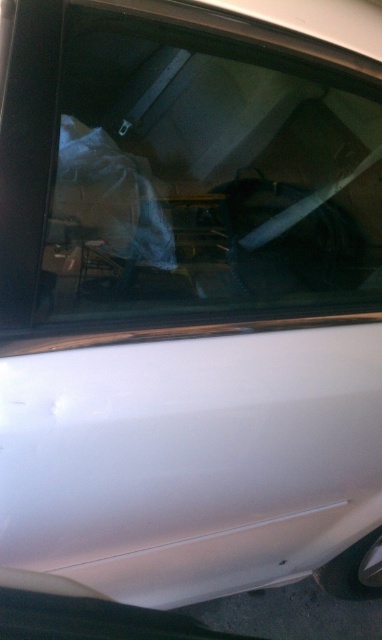
From the picture: You are a delivery person who just arrived at a customer service center. You see the transparent plastic bag at upper center and the white glossy car door at lower left in the image. Which object is positioned higher from the ground?

The transparent plastic bag at upper center is located above the white glossy car door at lower left, so it is higher from the ground.

You are examining the white car door and window in the garage. There are two points marked on the car door at coordinates point (171, 221) and point (169, 500). Which point is nearer to you when looking at the car door?

Point (171, 221) is closer to the viewer than point (169, 500).

You are a delivery person trying to determine where to place a new package. You see the transparent plastic bag at upper center and the white glossy car door at lower left. Which object is located to the right of the other?

The transparent plastic bag at upper center is positioned on the right side of white glossy car door at lower left.